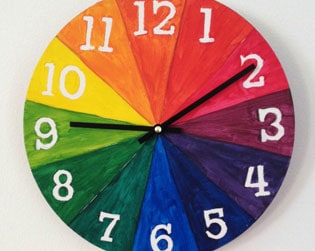
Find the location of a particular element. clock is located at coordinates (159, 201).